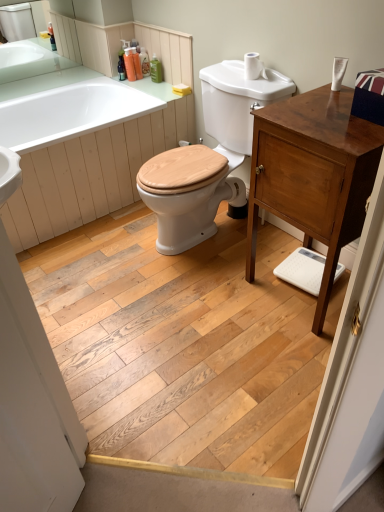
Where is `white glossy sink at upper center, positioned as the 1th sink in bottom-to-top order`? This screenshot has width=384, height=512. white glossy sink at upper center, positioned as the 1th sink in bottom-to-top order is located at coordinates (237, 105).

You are a GUI agent. You are given a task and a screenshot of the screen. Output one action in this format:
    pyautogui.click(x=<x>, y=<y>)
    Task: Click on the natural wood floor at center
    The width and height of the screenshot is (384, 512).
    Given the screenshot: What is the action you would take?
    pyautogui.click(x=183, y=343)

The image size is (384, 512). What do you see at coordinates (45, 82) in the screenshot? I see `green matte countertop at upper left` at bounding box center [45, 82].

Image resolution: width=384 pixels, height=512 pixels. In order to click on white glossy sink at upper center, acting as the 1th sink starting from the right in this screenshot , I will do `click(237, 105)`.

In the scene shown: From the image's perspective, which one is positioned lower, translucent orange soap at upper center, which is counted as the 1th toiletry, starting from the left, or white glossy sink at upper left, which is the first sink from back to front?

translucent orange soap at upper center, which is counted as the 1th toiletry, starting from the left, is shown below in the image.

Where is `the 1st toiletry counting from the right of the white glossy sink at upper left, which is the first sink from back to front`? Image resolution: width=384 pixels, height=512 pixels. the 1st toiletry counting from the right of the white glossy sink at upper left, which is the first sink from back to front is located at coordinates (129, 64).

Considering the sizes of objects translucent orange soap at upper center, which ranks as the fourth toiletry in right-to-left order, and white glossy sink at upper left, the 1th sink when ordered from top to bottom, in the image provided, who is taller, translucent orange soap at upper center, which ranks as the fourth toiletry in right-to-left order, or white glossy sink at upper left, the 1th sink when ordered from top to bottom,?

With more height is white glossy sink at upper left, the 1th sink when ordered from top to bottom.

From a real-world perspective, is translucent orange soap at upper center, which is counted as the 1th toiletry, starting from the left, above or below white glossy sink at upper left, arranged as the second sink when viewed from the right?

In terms of real-world spatial position, translucent orange soap at upper center, which is counted as the 1th toiletry, starting from the left, is below white glossy sink at upper left, arranged as the second sink when viewed from the right.

Can we say translucent orange soap at upper center, which is counted as the 1th toiletry, starting from the left, lies outside translucent plastic soap dispenser at upper center, arranged as the second toiletry when viewed from the right?

Yes.

Considering the positions of objects translucent orange soap at upper center, which ranks as the fourth toiletry in right-to-left order, and translucent plastic soap dispenser at upper center, arranged as the second toiletry when viewed from the right, in the image provided, who is behind, translucent orange soap at upper center, which ranks as the fourth toiletry in right-to-left order, or translucent plastic soap dispenser at upper center, arranged as the second toiletry when viewed from the right,?

translucent plastic soap dispenser at upper center, arranged as the second toiletry when viewed from the right, is further from the camera.

This screenshot has height=512, width=384. I want to click on toiletry that is the 2nd one when counting rightward from the translucent orange soap at upper center, which is counted as the 1th toiletry, starting from the left, so click(144, 61).

How many degrees apart are the facing directions of translucent orange soap at upper center, which is counted as the 1th toiletry, starting from the left, and translucent plastic soap dispenser at upper center, arranged as the second toiletry when viewed from the right?

They differ by 0.00913 degrees in their facing directions.

Do you think translucent plastic soap dispenser at upper center, placed as the third toiletry when sorted from left to right, is within translucent orange soap at upper center, which is counted as the 1th toiletry, starting from the left, or outside of it?

The correct answer is: outside.

From the image's perspective, is translucent plastic soap dispenser at upper center, placed as the third toiletry when sorted from left to right, located above or below translucent orange soap at upper center, which ranks as the fourth toiletry in right-to-left order?

Clearly, from the image's perspective, translucent plastic soap dispenser at upper center, placed as the third toiletry when sorted from left to right, is above translucent orange soap at upper center, which ranks as the fourth toiletry in right-to-left order.

Identify the location of the 2nd toiletry directly beneath the translucent orange soap at upper center, which ranks as the fourth toiletry in right-to-left order (from a real-world perspective). (144, 61).

Which object is closer to the camera taking this photo, translucent plastic soap dispenser at upper center, arranged as the second toiletry when viewed from the right, or translucent orange soap at upper center, which is counted as the 1th toiletry, starting from the left?

translucent orange soap at upper center, which is counted as the 1th toiletry, starting from the left, is more forward.

In the scene shown: Could you tell me if shiny brown cabinet at right is turned towards white matte toilet paper at upper right?

No.

This screenshot has height=512, width=384. I want to click on toilet paper behind the shiny brown cabinet at right, so click(253, 66).

Measure the distance from shiny brown cabinet at right to white matte toilet paper at upper right.

They are 28.38 inches apart.

Is white matte toilet paper at upper right inside shiny brown cabinet at right?

No, white matte toilet paper at upper right is not surrounded by shiny brown cabinet at right.

Is white glossy bathtub at upper left taller or shorter than white glossy sink at upper left, acting as the second sink starting from the bottom?

Clearly, white glossy bathtub at upper left is taller compared to white glossy sink at upper left, acting as the second sink starting from the bottom.

How far apart are white glossy bathtub at upper left and white glossy sink at upper left, acting as the second sink starting from the bottom?

A distance of 2.01 meters exists between white glossy bathtub at upper left and white glossy sink at upper left, acting as the second sink starting from the bottom.

Do you think white glossy bathtub at upper left is within white glossy sink at upper left, the 1th sink in the left-to-right sequence, or outside of it?

white glossy bathtub at upper left is not enclosed by white glossy sink at upper left, the 1th sink in the left-to-right sequence.

From the image's perspective, is white glossy bathtub at upper left positioned above or below white glossy sink at upper left, acting as the second sink starting from the bottom?

Clearly, from the image's perspective, white glossy bathtub at upper left is below white glossy sink at upper left, acting as the second sink starting from the bottom.

Considering the positions of objects translucent plastic soap dispenser at upper center, placed as the third toiletry when sorted from left to right, and white glossy sink at upper left, the second sink when ordered from front to back, in the image provided, who is more to the right, translucent plastic soap dispenser at upper center, placed as the third toiletry when sorted from left to right, or white glossy sink at upper left, the second sink when ordered from front to back,?

Positioned to the right is translucent plastic soap dispenser at upper center, placed as the third toiletry when sorted from left to right.

Between translucent plastic soap dispenser at upper center, placed as the third toiletry when sorted from left to right, and white glossy sink at upper left, arranged as the second sink when viewed from the right, which one has less height?

Standing shorter between the two is translucent plastic soap dispenser at upper center, placed as the third toiletry when sorted from left to right.

Looking at this image, is translucent plastic soap dispenser at upper center, arranged as the second toiletry when viewed from the right, facing towards white glossy sink at upper left, the second sink when ordered from front to back?

No, translucent plastic soap dispenser at upper center, arranged as the second toiletry when viewed from the right, is not oriented towards white glossy sink at upper left, the second sink when ordered from front to back.

From the image's perspective, which is below, translucent plastic soap dispenser at upper center, arranged as the second toiletry when viewed from the right, or white glossy sink at upper left, the 1th sink in the left-to-right sequence?

From the image's view, translucent plastic soap dispenser at upper center, arranged as the second toiletry when viewed from the right, is below.

Considering the points (249, 79) and (335, 116), which point is in front, point (249, 79) or point (335, 116)?

Positioned in front is point (335, 116).

Where is `toilet paper on the left of shiny brown cabinet at right`? toilet paper on the left of shiny brown cabinet at right is located at coordinates (253, 66).

Which object is positioned more to the left, white matte toilet paper at upper right or shiny brown cabinet at right?

white matte toilet paper at upper right.

Would you say shiny brown cabinet at right is part of white matte toilet paper at upper right's contents?

No, white matte toilet paper at upper right does not contain shiny brown cabinet at right.

I want to click on sink that appears on the left of translucent orange soap at upper center, which ranks as the fourth toiletry in right-to-left order, so click(x=18, y=33).

From a real-world perspective, which toiletry is the 2nd one above the translucent plastic soap dispenser at upper center, arranged as the second toiletry when viewed from the right? Please provide its 2D coordinates.

[(129, 64)]

Looking at the image, which one is located closer to white glossy sink at upper center, acting as the 2th sink starting from the back, translucent orange soap at upper center, which ranks as the fourth toiletry in right-to-left order, or green matte countertop at upper left?

The object closer to white glossy sink at upper center, acting as the 2th sink starting from the back, is translucent orange soap at upper center, which ranks as the fourth toiletry in right-to-left order.

Looking at the image, which one is located further to white matte toilet paper at upper right, white glossy sink at upper center, positioned as the 1th sink in bottom-to-top order, or natural wood floor at center?

Among the two, natural wood floor at center is located further to white matte toilet paper at upper right.

Looking at the image, which one is located closer to white glossy sink at upper left, acting as the second sink starting from the bottom, white glossy sink at upper center, acting as the 2th sink starting from the back, or natural wood screen door at lower left?

Among the two, white glossy sink at upper center, acting as the 2th sink starting from the back, is located nearer to white glossy sink at upper left, acting as the second sink starting from the bottom.

In the scene shown: From the image, which object appears to be farther from white matte toilet paper at upper right, white glossy bathtub at upper left or green matte countertop at upper left?

green matte countertop at upper left lies further to white matte toilet paper at upper right than the other object.

Considering their positions, is white glossy sink at upper left, the 1th sink in the left-to-right sequence, positioned closer to white glossy sink at upper center, positioned as the 1th sink in bottom-to-top order, than translucent plastic soap dispenser at upper center, the second toiletry positioned from the left?

translucent plastic soap dispenser at upper center, the second toiletry positioned from the left, is positioned closer to the anchor white glossy sink at upper center, positioned as the 1th sink in bottom-to-top order.

When comparing their distances from white glossy sink at upper left, the second sink when ordered from front to back, does white glossy bathtub at upper left or green matte bottle at upper center, placed as the first toiletry when sorted from right to left, seem closer?

The object closer to white glossy sink at upper left, the second sink when ordered from front to back, is green matte bottle at upper center, placed as the first toiletry when sorted from right to left.

Considering their positions, is white glossy sink at upper left, acting as the second sink starting from the bottom, positioned further to translucent orange soap at upper center, which is counted as the 1th toiletry, starting from the left, than translucent plastic soap dispenser at upper center, which is counted as the 3th toiletry, starting from the right?

white glossy sink at upper left, acting as the second sink starting from the bottom, is positioned further to the anchor translucent orange soap at upper center, which is counted as the 1th toiletry, starting from the left.

When comparing their distances from translucent plastic soap dispenser at upper center, which is counted as the 3th toiletry, starting from the right, does green matte bottle at upper center, placed as the first toiletry when sorted from right to left, or shiny brown cabinet at right seem closer?

green matte bottle at upper center, placed as the first toiletry when sorted from right to left, is positioned closer to the anchor translucent plastic soap dispenser at upper center, which is counted as the 3th toiletry, starting from the right.

Identify the location of counter top between shiny brown cabinet at right and translucent plastic soap dispenser at upper center, the second toiletry positioned from the left, along the z-axis. (45, 82).

Where is `sink between white glossy bathtub at upper left and natural wood floor at center vertically`? Image resolution: width=384 pixels, height=512 pixels. sink between white glossy bathtub at upper left and natural wood floor at center vertically is located at coordinates (237, 105).

Identify the location of bathroom cabinet between natural wood screen door at lower left and translucent plastic soap dispenser at upper center, arranged as the second toiletry when viewed from the right, from front to back. The height and width of the screenshot is (512, 384). (313, 174).

Locate an element on the screen. The width and height of the screenshot is (384, 512). toiletry located between white glossy sink at upper left, arranged as the second sink when viewed from the right, and translucent plastic soap dispenser at upper center, the second toiletry positioned from the left, in the left-right direction is located at coordinates (129, 64).